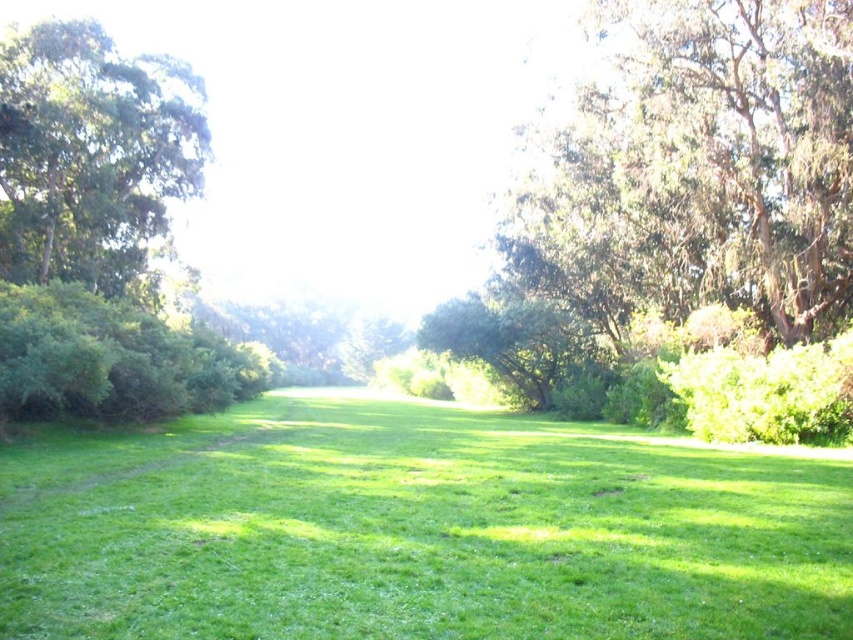
Question: Estimate the real-world distances between objects in this image. Which object is farther from the green grassy field at center?

Choices:
 (A) green leafy tree at left
 (B) green leafy tree at upper right

Answer: (A)

Question: From the image, what is the correct spatial relationship of green grassy field at center in relation to green leafy tree at left?

Choices:
 (A) right
 (B) left

Answer: (A)

Question: Which object is the farthest from the green leafy tree at upper right?

Choices:
 (A) green grassy field at center
 (B) green leafy tree at left

Answer: (B)

Question: Is green grassy field at center to the right of green leafy tree at upper right from the viewer's perspective?

Choices:
 (A) yes
 (B) no

Answer: (B)

Question: Can you confirm if green grassy field at center is smaller than green leafy tree at upper right?

Choices:
 (A) no
 (B) yes

Answer: (B)

Question: Which object is positioned closest to the green leafy tree at left?

Choices:
 (A) green grassy field at center
 (B) green leafy tree at upper right

Answer: (A)